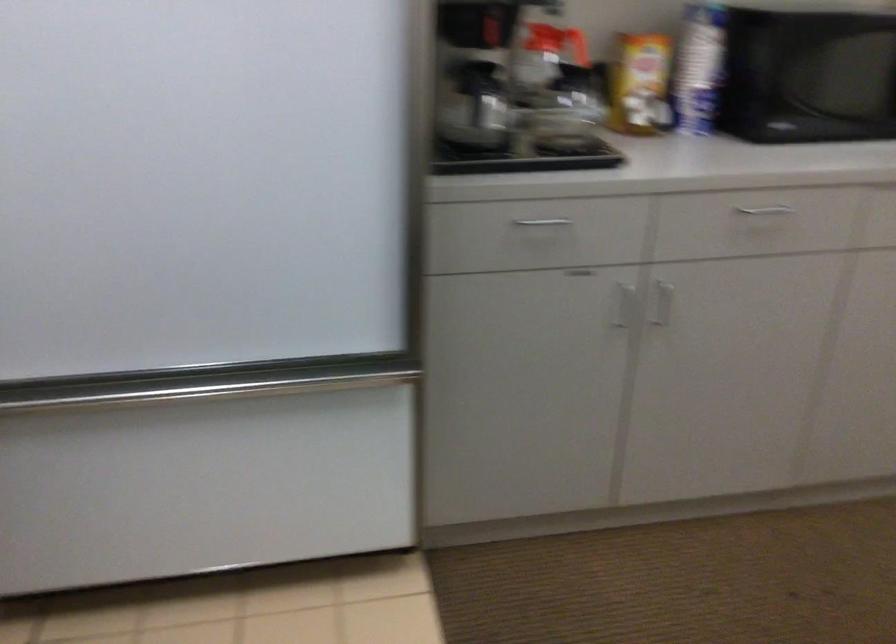
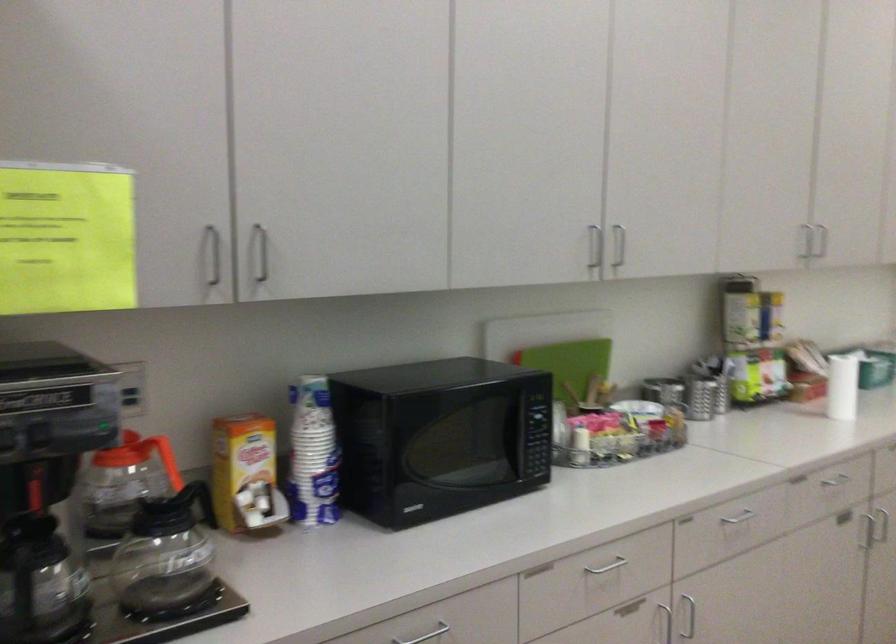
Where in the second image is the point corresponding to (641,75) from the first image?

(244, 471)